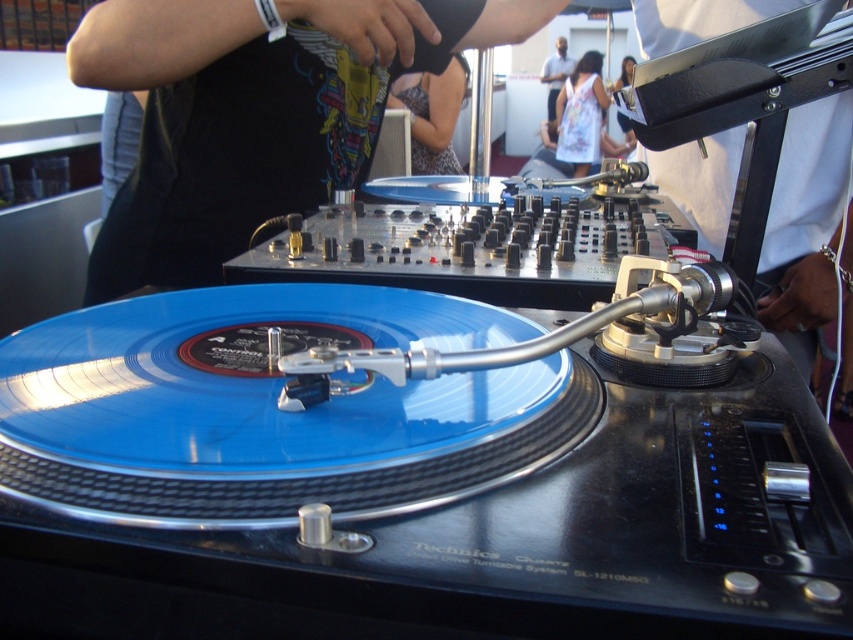
Question: Which point appears farthest from the camera in this image?

Choices:
 (A) (579, 96)
 (B) (550, 76)

Answer: (B)

Question: Among these objects, which one is farthest from the camera?

Choices:
 (A) dark blue shirt at upper center
 (B) patterned fabric dress at center

Answer: (A)

Question: Where is dark blue shirt at upper center located in relation to metallic silver microphone at upper center in the image?

Choices:
 (A) left
 (B) right

Answer: (A)

Question: In this image, where is patterned fabric dress at center located relative to white floral dress at center?

Choices:
 (A) above
 (B) below

Answer: (B)

Question: Does white floral dress at center appear under dark blue shirt at upper center?

Choices:
 (A) yes
 (B) no

Answer: (A)

Question: Which point is closer to the camera?

Choices:
 (A) black matte shirt at upper center
 (B) patterned fabric dress at center
 (C) metallic silver microphone at upper center

Answer: (A)